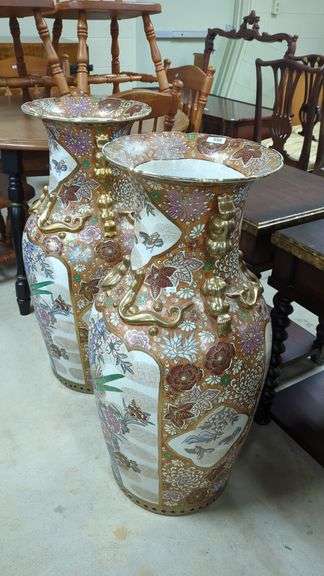
This screenshot has height=576, width=324. Identify the location of door. (183, 14).